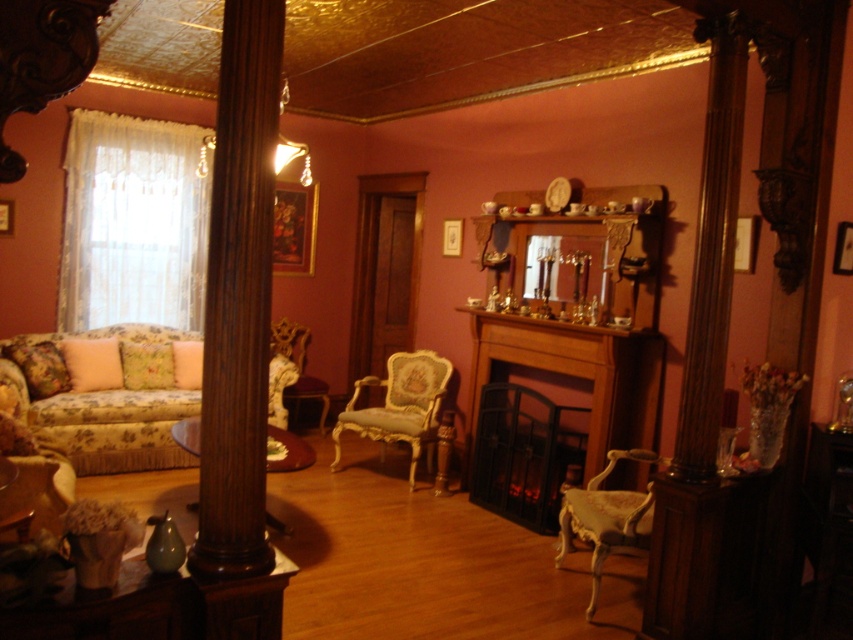
Question: Estimate the real-world distances between objects in this image. Which object is farther from the velvet gold armchair at lower left?

Choices:
 (A) floral-patterned fabric couch at left
 (B) gold upholstered armchair at center
 (C) wooden fireplace at center

Answer: (C)

Question: From the image, what is the correct spatial relationship of gold upholstered armchair at center in relation to velvet purple armchair at center?

Choices:
 (A) left
 (B) right

Answer: (B)

Question: Is white lace curtain at left wider than velvet gold armchair at lower left?

Choices:
 (A) yes
 (B) no

Answer: (A)

Question: Which point is closer to the camera?

Choices:
 (A) (590, 432)
 (B) (4, 435)

Answer: (B)

Question: Which of the following is the farthest from the observer?

Choices:
 (A) (569, 499)
 (B) (567, 332)
 (C) (91, 403)

Answer: (C)

Question: Is white lace curtain at left positioned in front of white upholstered armchair at center?

Choices:
 (A) yes
 (B) no

Answer: (B)